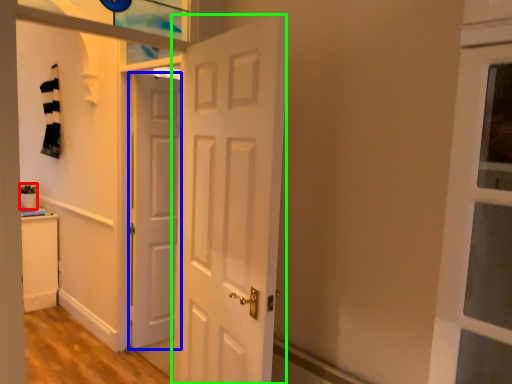
Question: Which object is the farthest from houseplant (highlighted by a red box)? Choose among these: door (highlighted by a blue box) or door (highlighted by a green box).

Choices:
 (A) door
 (B) door

Answer: (B)